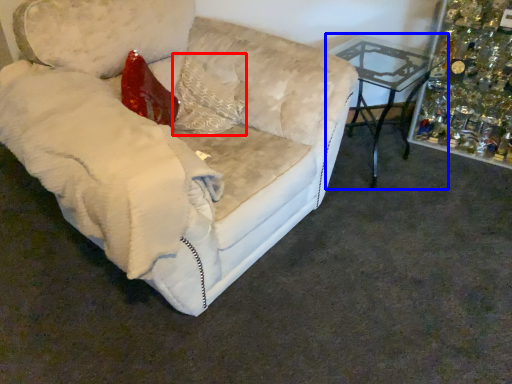
Question: Which point is closer to the camera, pillow (highlighted by a red box) or table (highlighted by a blue box)?

Choices:
 (A) pillow
 (B) table

Answer: (A)